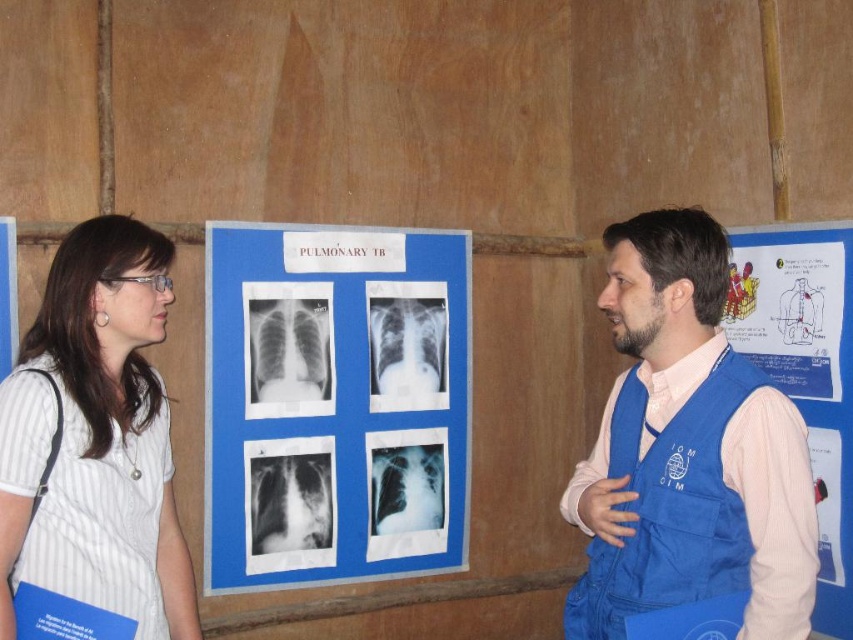
Question: Observing the image, what is the correct spatial positioning of white paper at center in reference to white striped shirt at left?

Choices:
 (A) left
 (B) right

Answer: (B)

Question: Which object is positioned closest to the blue fabric vest at center?

Choices:
 (A) white paper at center
 (B) blue fabric poster at center

Answer: (B)

Question: Considering the relative positions of white striped shirt at left and blue fabric poster at center in the image provided, where is white striped shirt at left located with respect to blue fabric poster at center?

Choices:
 (A) left
 (B) right

Answer: (A)

Question: Among these objects, which one is nearest to the camera?

Choices:
 (A) blue fabric vest at center
 (B) blue fabric poster at center
 (C) white striped shirt at left
 (D) white paper at center

Answer: (A)

Question: Which object is farther from the camera taking this photo?

Choices:
 (A) white striped shirt at left
 (B) blue fabric vest at center

Answer: (A)

Question: Is white paper at center thinner than blue fabric poster at center?

Choices:
 (A) no
 (B) yes

Answer: (A)